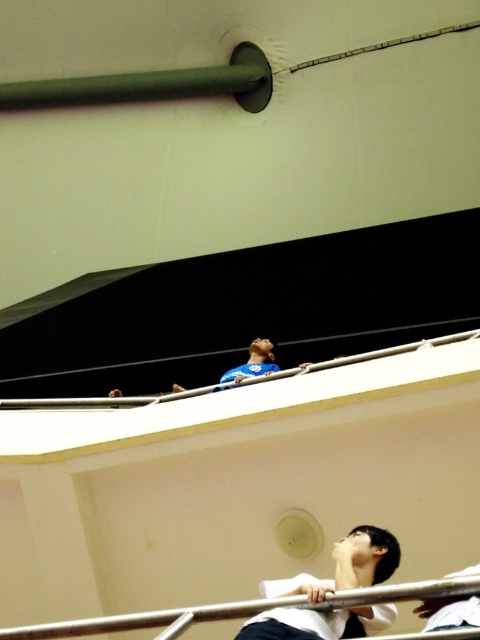
Does green matte pole at upper left have a smaller size compared to black matte shirt at lower center?

Incorrect, green matte pole at upper left is not smaller in size than black matte shirt at lower center.

Which is above, green matte pole at upper left or black matte shirt at lower center?

Positioned higher is green matte pole at upper left.

Does point (167, 92) come closer to viewer compared to point (367, 632)?

That is False.

Identify the location of green matte pole at upper left. (152, 84).